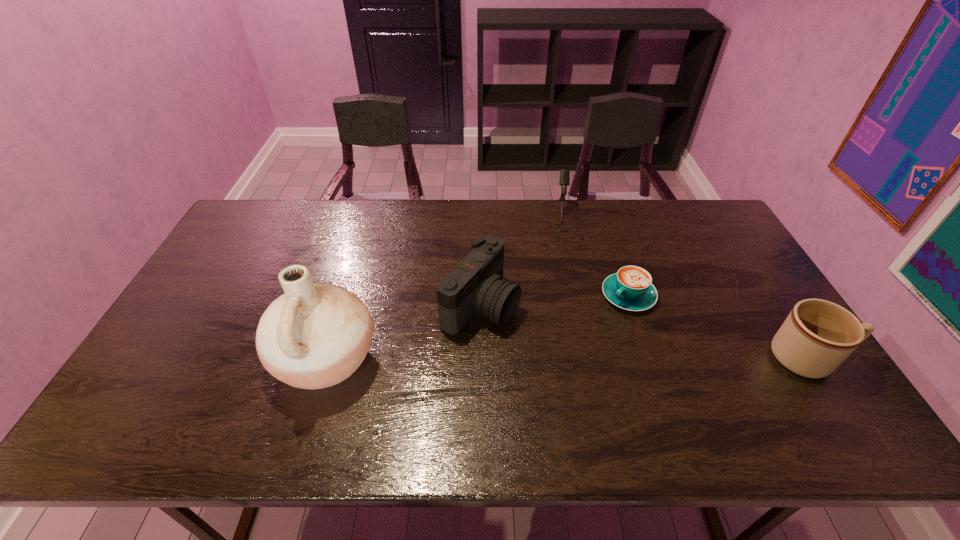
Identify the location of vacant space on the desktop that is between the tallest object and the mug and is positioned with the handle on the right side of the shortest object. This screenshot has height=540, width=960. (554, 359).

At what (x,y) coordinates should I click in order to perform the action: click on vacant space on the desktop that is between the leftmost object and the mug and is positioned at the lens of the fourth object from right to left. Please return your answer as a coordinate pair (x, y). Image resolution: width=960 pixels, height=540 pixels. Looking at the image, I should click on (593, 359).

Locate an element on the screen. vacant spot on the desktop that is between the leftmost object and the rightmost object and is positioned on the stand of the farthest object is located at coordinates (568, 359).